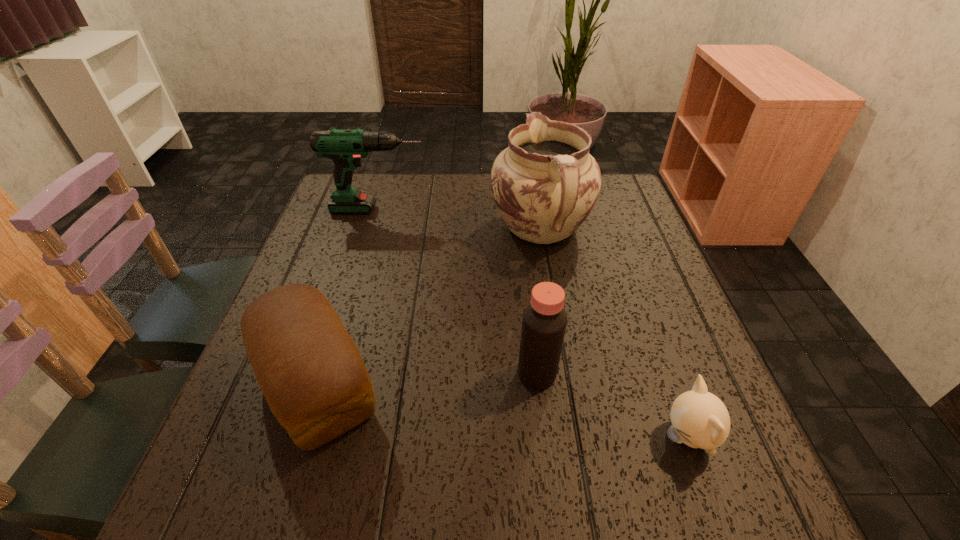
This screenshot has height=540, width=960. Find the location of `object situated at the far left corner`. object situated at the far left corner is located at coordinates (346, 147).

Image resolution: width=960 pixels, height=540 pixels. Find the location of `object that is positioned at the far right corner`. object that is positioned at the far right corner is located at coordinates (545, 184).

This screenshot has width=960, height=540. In order to click on object that is at the near right corner in this screenshot , I will do `click(699, 419)`.

Locate an element on the screen. The height and width of the screenshot is (540, 960). free space at the far edge is located at coordinates (432, 186).

The height and width of the screenshot is (540, 960). In order to click on vacant space at the near edge of the desktop in this screenshot , I will do `click(471, 516)`.

Find the location of a particular element. Image resolution: width=960 pixels, height=540 pixels. vacant area at the left edge of the desktop is located at coordinates (252, 391).

Where is `blank area at the right edge`? The width and height of the screenshot is (960, 540). blank area at the right edge is located at coordinates (600, 275).

Identify the location of vacant space at the far left corner of the desktop. (384, 192).

This screenshot has height=540, width=960. In order to click on vacant space at the far right corner of the desktop in this screenshot , I will do `click(617, 173)`.

The height and width of the screenshot is (540, 960). I want to click on free space between the drill and the bread, so click(x=348, y=297).